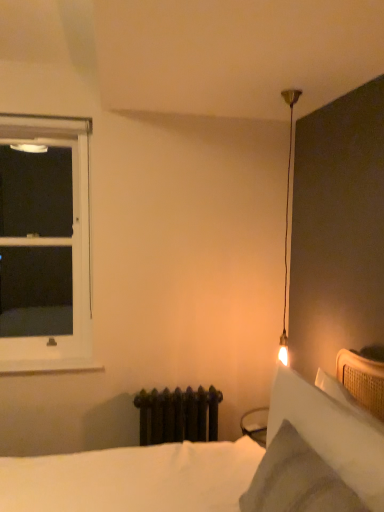
Question: Would you say white matte window sill at lower left contains white soft bed at lower right?

Choices:
 (A) no
 (B) yes

Answer: (A)

Question: From the image's perspective, is white matte window sill at lower left under white soft bed at lower right?

Choices:
 (A) no
 (B) yes

Answer: (A)

Question: Considering the relative positions of white matte window sill at lower left and white soft bed at lower right in the image provided, is white matte window sill at lower left to the right of white soft bed at lower right from the viewer's perspective?

Choices:
 (A) no
 (B) yes

Answer: (A)

Question: Does white matte window sill at lower left have a larger size compared to white soft bed at lower right?

Choices:
 (A) yes
 (B) no

Answer: (B)

Question: Is white matte window sill at lower left closer to the viewer compared to white soft bed at lower right?

Choices:
 (A) yes
 (B) no

Answer: (B)

Question: From a real-world perspective, does white matte window sill at lower left stand above white soft bed at lower right?

Choices:
 (A) no
 (B) yes

Answer: (A)

Question: From a real-world perspective, is white plastic window at left located higher than white soft pillow at upper right?

Choices:
 (A) no
 (B) yes

Answer: (B)

Question: From the image's perspective, does white plastic window at left appear lower than white soft pillow at upper right?

Choices:
 (A) yes
 (B) no

Answer: (B)

Question: Does white plastic window at left touch white soft pillow at upper right?

Choices:
 (A) no
 (B) yes

Answer: (A)

Question: Can you confirm if white plastic window at left is smaller than white soft pillow at upper right?

Choices:
 (A) yes
 (B) no

Answer: (B)

Question: From the image's perspective, is white plastic window at left on white soft pillow at upper right?

Choices:
 (A) yes
 (B) no

Answer: (A)

Question: Could you tell me if white plastic window at left is turned towards white soft pillow at upper right?

Choices:
 (A) no
 (B) yes

Answer: (A)

Question: From a real-world perspective, does white soft bed at lower right sit lower than white matte window sill at lower left?

Choices:
 (A) no
 (B) yes

Answer: (A)